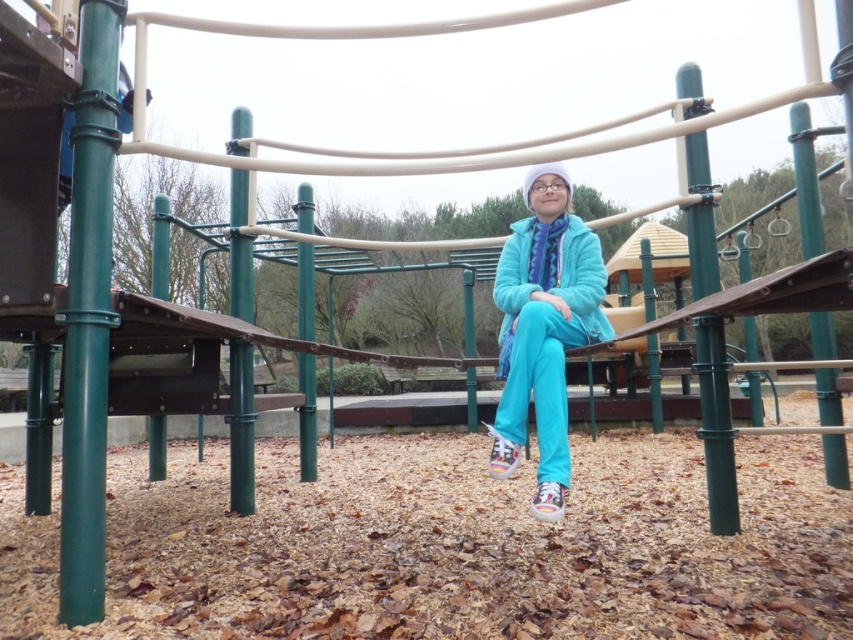
You are a photographer trying to capture a closeup of the child in the playground. You have a camera with a lens that can focus on objects within a 3 inch range. Can you focus on both the turquoise fabric jacket at center and the matte blue jacket at center at the same time?

The turquoise fabric jacket at center is 3.76 inches from the matte blue jacket at center. Since the distance between them is greater than the 3 inch range of the camera lens, you cannot focus on both jackets simultaneously.

You are a photographer trying to capture a candid shot of the child wearing the turquoise fabric jacket at center. Your camera is positioned at a certain distance. Can you determine if you can comfortably frame the child within your camera viewfinder without moving closer or farther?

The distance between the turquoise fabric jacket at center and the camera is 8.19 feet. Since this distance is within a comfortable framing range for most cameras, you can likely capture the child wearing the turquoise fabric jacket at center within the viewfinder without needing to adjust your position.

You are a photographer trying to capture a clear shot of the child in the playground. You notice two jackets on the child, the turquoise fabric jacket at center and the matte blue jacket at center. Which jacket is more likely to block the view of the child if you position yourself to the left of the child?

The turquoise fabric jacket at center might be wider than matte blue jacket at center, so positioning yourself to the left of the child could result in the turquoise fabric jacket at center blocking the view more than the matte blue jacket at center.